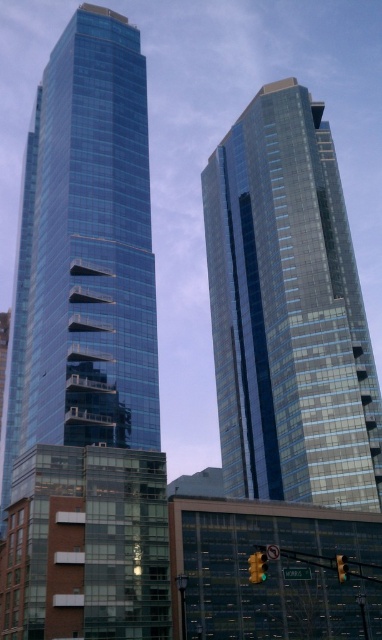
You are a pedestrian standing at an intersection and see two traffic lights ahead. The amber glass traffic light at center and the yellow glass traffic light at center. Which one is above the other?

The amber glass traffic light at center is positioned over the yellow glass traffic light at center.

From the picture: You are a pedestrian standing at an intersection and see both the amber glass traffic light at center and the yellow glass traffic light at center. Which traffic light is located to the left?

The amber glass traffic light at center is positioned to the left of the yellow glass traffic light at center.

You are standing in front of the two skyscrapers and want to take a photo that includes both points, point (113, 403) and point (338, 576). Which point will appear closer to the camera in the photo?

Point (113, 403) is further to the camera than point (338, 576), so it will appear closer to the camera in the photo.